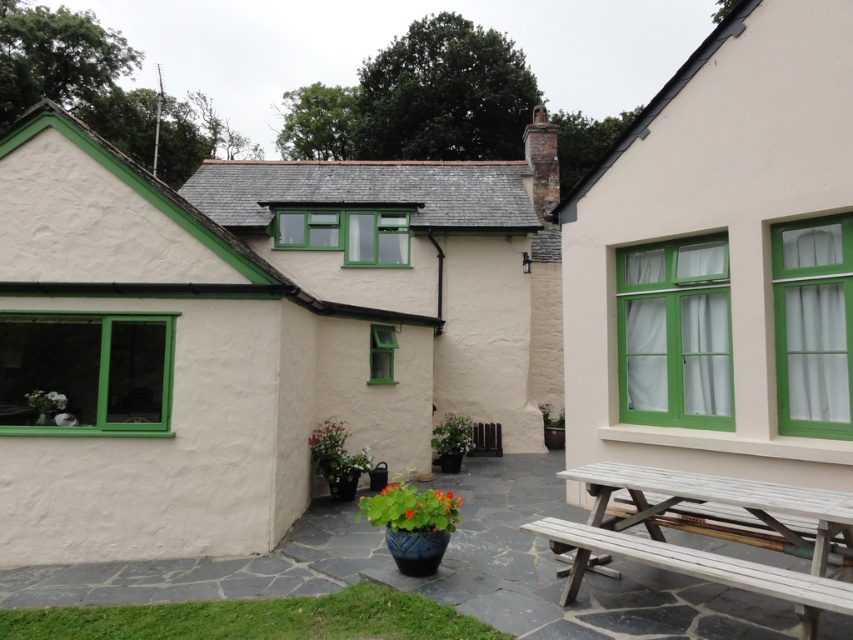
Between white wooden picnic table at lower right and light brown wooden bench at lower right, which one has more height?

white wooden picnic table at lower right is taller.

Between white wooden picnic table at lower right and light brown wooden bench at lower right, which one is positioned higher?

white wooden picnic table at lower right is above.

Is point (686, 477) in front of point (646, 524)?

Yes, it is in front of point (646, 524).

You are a GUI agent. You are given a task and a screenshot of the screen. Output one action in this format:
    pyautogui.click(x=<x>, y=<y>)
    Task: Click on the white wooden picnic table at lower right
    
    Given the screenshot: What is the action you would take?
    pyautogui.click(x=701, y=550)

Is white wood picnic table at right thinner than light brown wooden bench at lower right?

Yes, white wood picnic table at right is thinner than light brown wooden bench at lower right.

Which is in front, point (640, 179) or point (747, 525)?

Point (747, 525)

In order to click on white wood picnic table at right in this screenshot , I will do `click(722, 260)`.

Can you confirm if white wood picnic table at right is wider than white wooden picnic table at lower right?

In fact, white wood picnic table at right might be narrower than white wooden picnic table at lower right.

What do you see at coordinates (722, 260) in the screenshot? This screenshot has height=640, width=853. I see `white wood picnic table at right` at bounding box center [722, 260].

Locate an element on the screen. Image resolution: width=853 pixels, height=640 pixels. white wood picnic table at right is located at coordinates (722, 260).